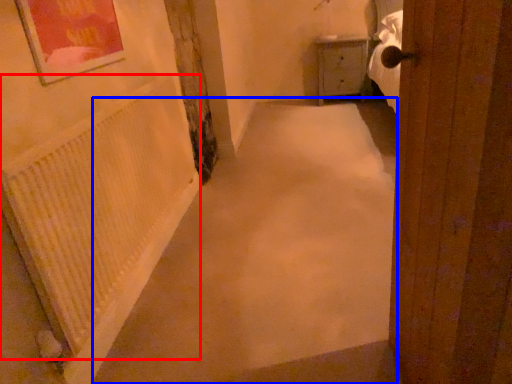
Question: Which point is closer to the camera, radiator (highlighted by a red box) or alley (highlighted by a blue box)?

Choices:
 (A) radiator
 (B) alley

Answer: (A)